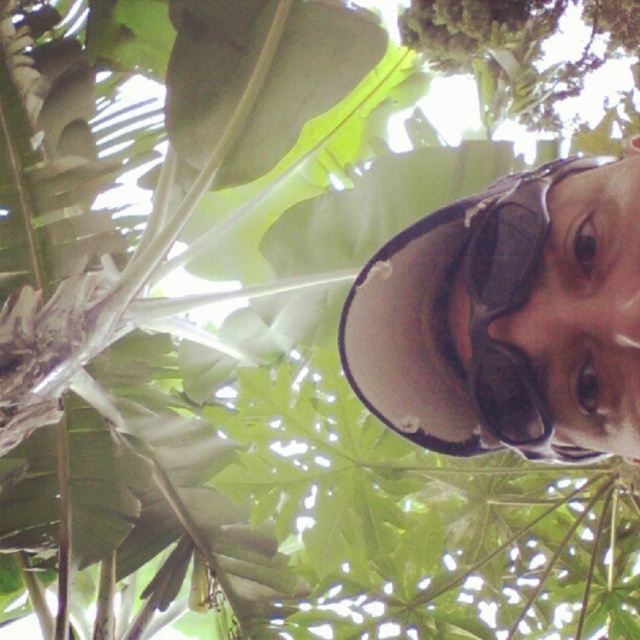
Consider the image. You are a photographer trying to capture a clear shot of the white matte hat at upper center and the black matte goggles at upper right. Given the distance between them, do you think you can focus on both objects simultaneously without adjusting your camera settings?

The white matte hat at upper center is only 0.86 inches away from the black matte goggles at upper right. Since they are very close to each other, you can focus on both objects simultaneously without needing to adjust your camera settings.

You are a photographer trying to capture a clear shot of the black matte goggles at upper right. However, the white matte hat at upper center is blocking your view. Can you adjust your position to the left or right to get an unobstructed view of the goggles?

The white matte hat at upper center is positioned on the right side of black matte goggles at upper right. To get an unobstructed view of the black matte goggles at upper right, you should move to the left side of the scene so that the hat no longer blocks the goggles.

You are navigating through a dense tropical garden using a map with coordinates. You need to reach point A at point (465, 253) and point B at point (545, 436). Which point is closer to your current position if you are standing at the center of the garden?

Point B at point (545, 436) is closer to your current position because it is in front of point A at point (465, 253), which is further away.